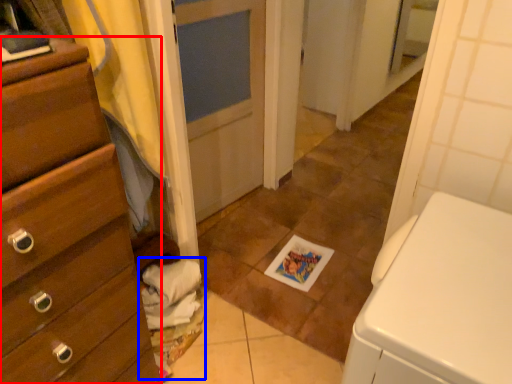
Question: Which point is further to the camera, chest of drawers (highlighted by a red box) or laundry (highlighted by a blue box)?

Choices:
 (A) chest of drawers
 (B) laundry

Answer: (B)